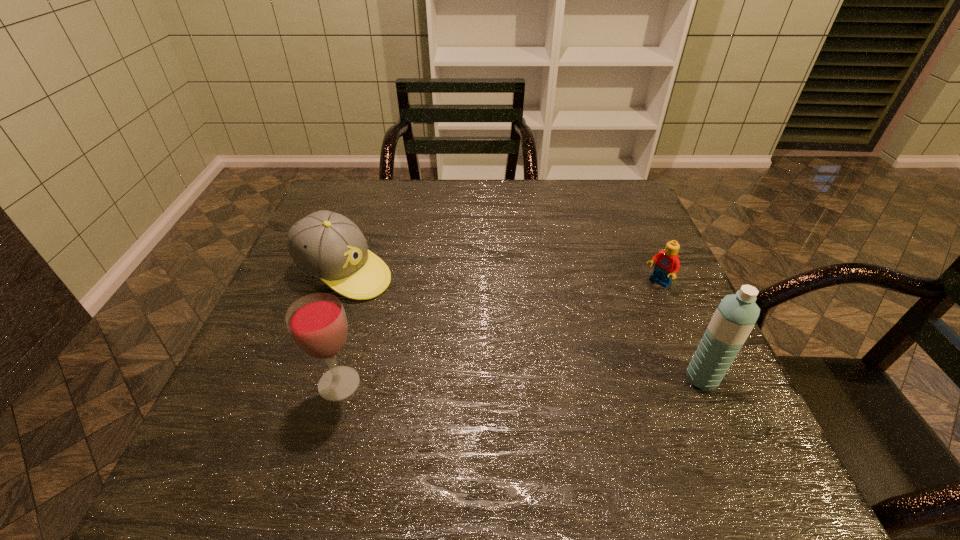
Where is `vacant space that is in between the shortest object and the baseball cap`? The width and height of the screenshot is (960, 540). vacant space that is in between the shortest object and the baseball cap is located at coordinates (501, 278).

Find the location of a particular element. vacant area that lies between the Lego and the baseball cap is located at coordinates (501, 278).

The width and height of the screenshot is (960, 540). Find the location of `object that is the closest one to the Lego`. object that is the closest one to the Lego is located at coordinates (736, 315).

Locate which object is the closest to the third tallest object. Please provide its 2D coordinates. Your answer should be formatted as a tuple, i.e. [(x, y)], where the tuple contains the x and y coordinates of a point satisfying the conditions above.

[(317, 323)]

Image resolution: width=960 pixels, height=540 pixels. In order to click on free point that satisfies the following two spatial constraints: 1. on the back side of the water bottle; 2. on the right side of the second tallest object in this screenshot , I will do `click(341, 378)`.

Where is `free location that satisfies the following two spatial constraints: 1. on the back side of the Lego; 2. on the left side of the third shortest object`? Image resolution: width=960 pixels, height=540 pixels. free location that satisfies the following two spatial constraints: 1. on the back side of the Lego; 2. on the left side of the third shortest object is located at coordinates (367, 283).